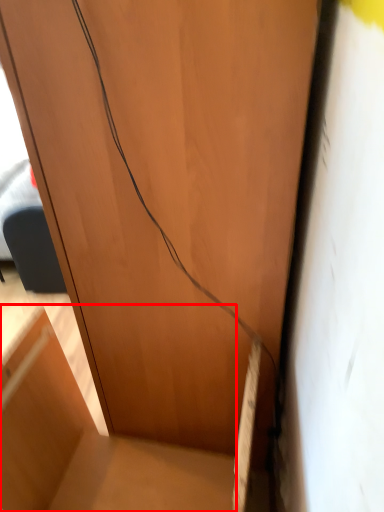
Question: From the image, what is the correct spatial relationship of furniture (annotated by the red box) in relation to wire?

Choices:
 (A) left
 (B) right

Answer: (A)